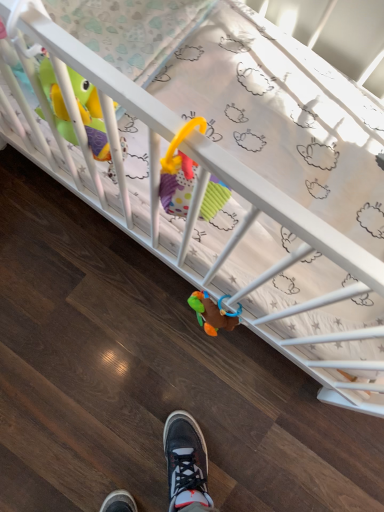
Describe the element at coordinates (212, 313) in the screenshot. I see `multicolored fabric toy at center` at that location.

Locate an element on the screen. This screenshot has height=512, width=384. multicolored fabric toy at center is located at coordinates (212, 313).

You are a GUI agent. You are given a task and a screenshot of the screen. Output one action in this format:
    pyautogui.click(x=<x>, y=<y>)
    Task: Click on the multicolored fabric toy at center
    
    Given the screenshot: What is the action you would take?
    pyautogui.click(x=212, y=313)